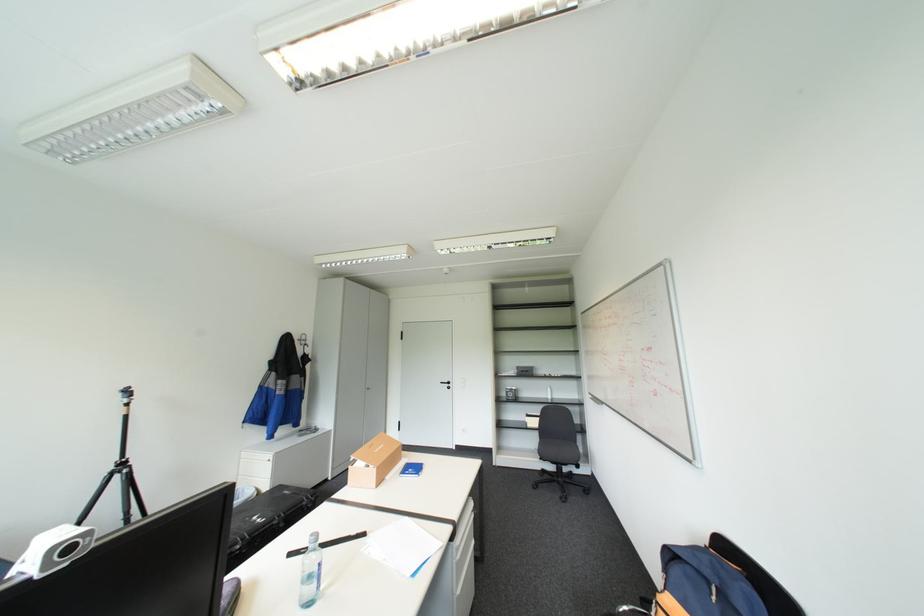
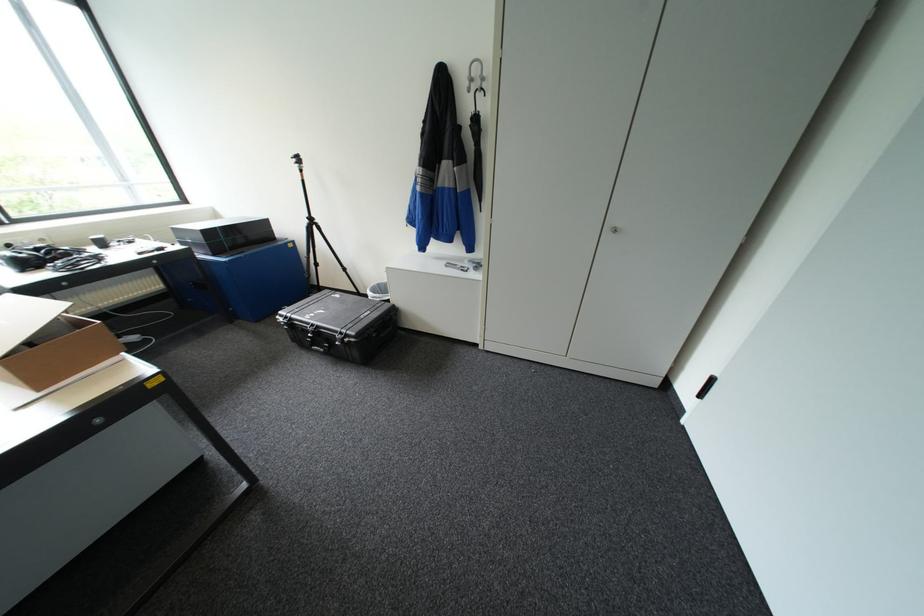
Find the pixel in the second image that matches point 126,475 in the first image.

(318, 225)